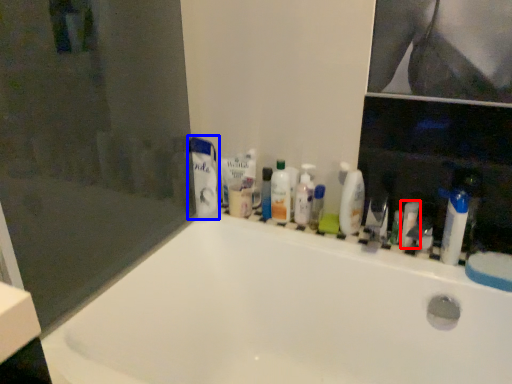
Question: Among these objects, which one is farthest to the camera, toiletry (highlighted by a red box) or toothpaste (highlighted by a blue box)?

Choices:
 (A) toiletry
 (B) toothpaste

Answer: (B)